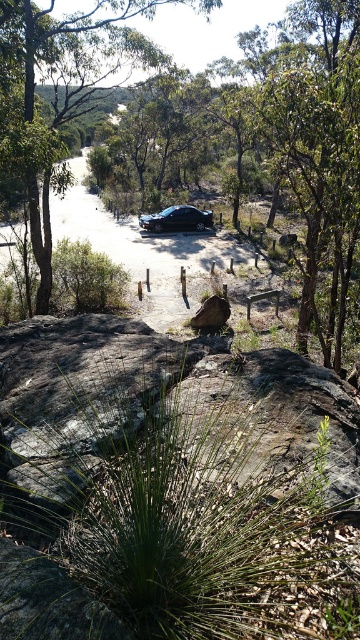
You are standing at the point marked by the coordinates point (x=59, y=92). Looking around, you see a green leafy tree at center. Which direction should you face to see the black car parked on the road?

The point (x=59, y=92) marks the green leafy tree at center. The black car is parked on the road in the middle ground, so you should face towards the middle ground direction to see the black car parked on the road.

You are standing at the edge of the rocky terrain in the foreground and want to take a photo of both point (42, 186) and point (228, 312). Which point will appear closer to the bottom of your camera view?

Point (228, 312) will appear closer to the bottom of your camera view because it is farther from the camera compared to point (42, 186), which is closer.

You are standing at the coordinates where the black car is parked on the paved path. You want to walk directly towards the green leafy tree at center. What direction should you face to walk straight towards it?

The green leafy tree at center is located at coordinates point (x=59, y=92). Since you are at the black car position on the paved path, you should face the direction towards the tree to walk straight towards it.